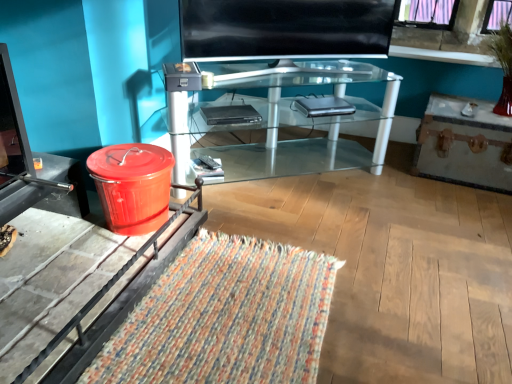
The image size is (512, 384). In order to click on free area in between woven multicolored mat at lower left and metallic silver drawer at right in this screenshot , I will do (384, 228).